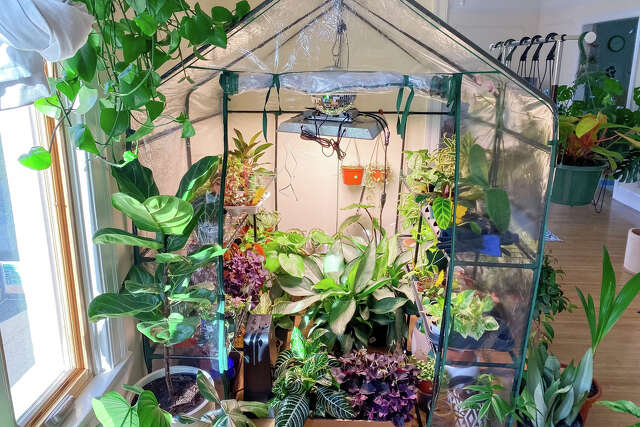
The image size is (640, 427). I want to click on hanging baskets, so click(582, 163), click(546, 94), click(525, 81).